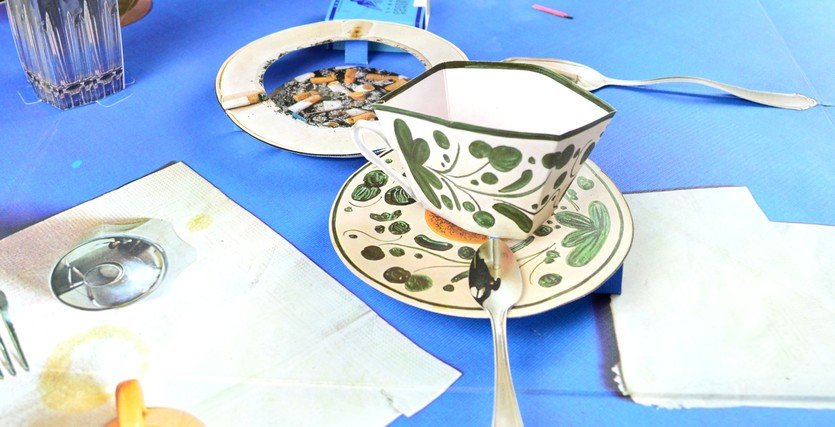
Find the location of a particular element. glass vase is located at coordinates (62, 16).